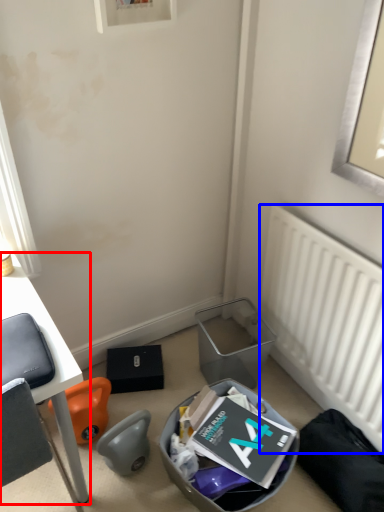
Question: Which object is further to the camera taking this photo, desk (highlighted by a red box) or radiator (highlighted by a blue box)?

Choices:
 (A) desk
 (B) radiator

Answer: (B)